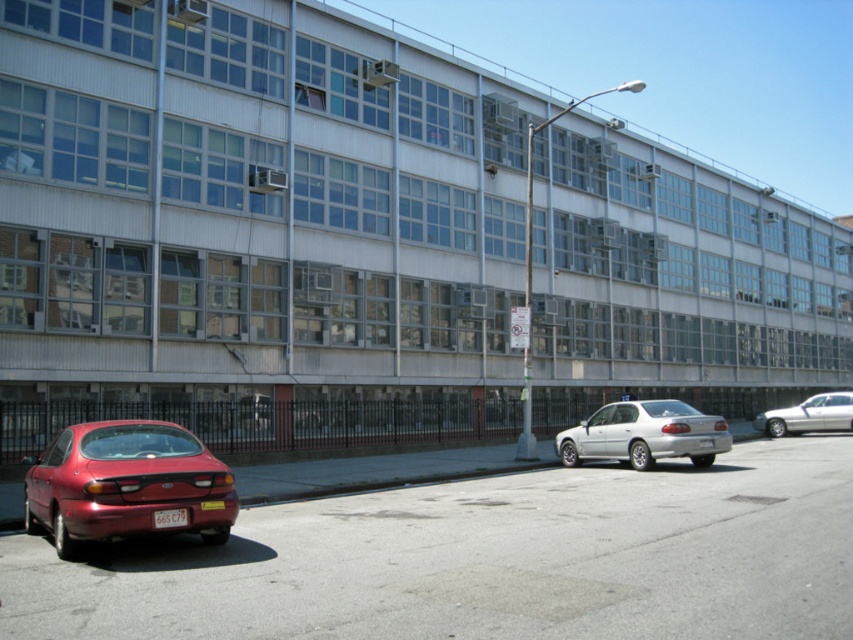
Question: Considering the relative positions of silver metallic sedan at center-right and silver metallic sedan at right in the image provided, where is silver metallic sedan at center-right located with respect to silver metallic sedan at right?

Choices:
 (A) above
 (B) below

Answer: (A)

Question: Which of the following is the closest to the observer?

Choices:
 (A) (183, 508)
 (B) (195, 515)

Answer: (A)

Question: Does shiny red sedan at lower left have a greater width compared to silver metallic sedan at center-right?

Choices:
 (A) yes
 (B) no

Answer: (B)

Question: Which object is closer to the camera taking this photo?

Choices:
 (A) shiny red sedan at lower left
 (B) silver metallic sedan at right
 (C) red plastic license plate at lower left

Answer: (A)

Question: Which object is positioned closest to the shiny red sedan at lower left?

Choices:
 (A) red plastic license plate at lower left
 (B) silver metallic sedan at right
 (C) silver metallic sedan at center-right

Answer: (A)

Question: Does silver metallic sedan at right appear under red plastic license plate at lower left?

Choices:
 (A) yes
 (B) no

Answer: (A)